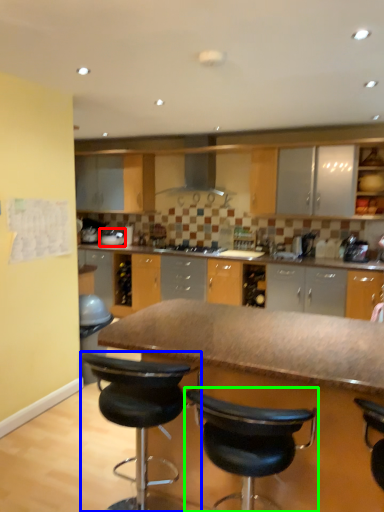
Question: Estimate the real-world distances between objects in this image. Which object is farther from appliance (highlighted by a red box), chair (highlighted by a blue box) or chair (highlighted by a green box)?

Choices:
 (A) chair
 (B) chair

Answer: (B)